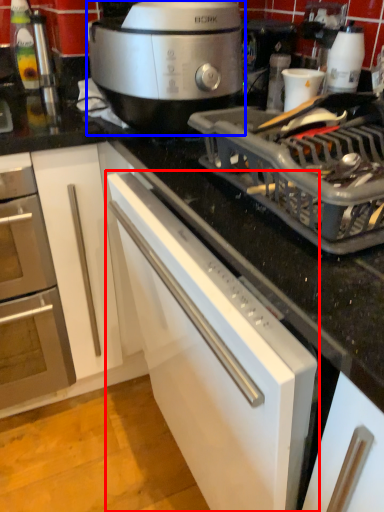
Question: Among these objects, which one is farthest to the camera, cabinetry (highlighted by a red box) or slow cooker (highlighted by a blue box)?

Choices:
 (A) cabinetry
 (B) slow cooker

Answer: (B)